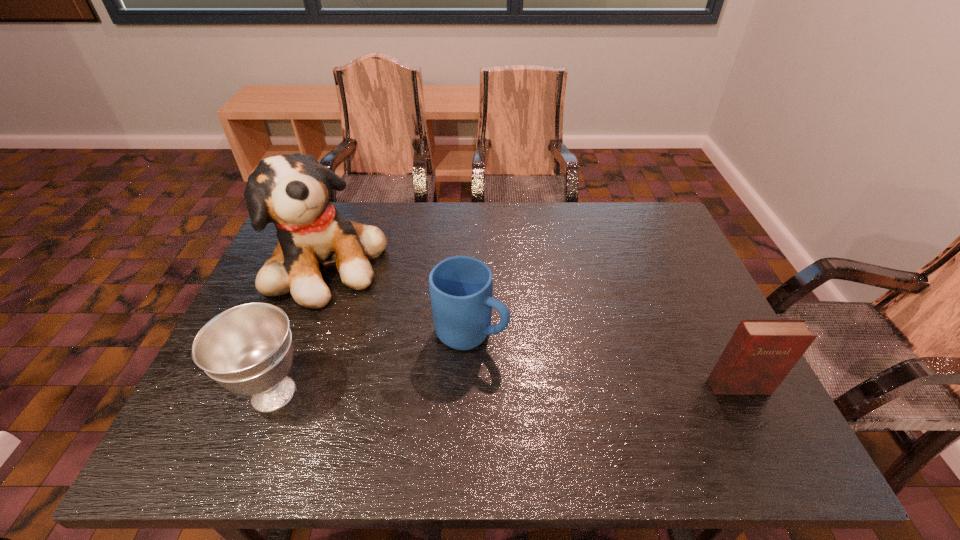
What are the coordinates of `object at the near right corner` in the screenshot? It's located at (761, 352).

This screenshot has width=960, height=540. In order to click on free point at the far edge in this screenshot , I will do `click(590, 246)`.

Find the location of a particular element. This screenshot has height=540, width=960. free space at the near edge of the desktop is located at coordinates (370, 384).

At what (x,y) coordinates should I click in order to perform the action: click on free space at the right edge of the desktop. Please return your answer as a coordinate pair (x, y). Image resolution: width=960 pixels, height=540 pixels. Looking at the image, I should click on (667, 320).

What are the coordinates of `vacant space at the near right corner` in the screenshot? It's located at tap(700, 404).

This screenshot has width=960, height=540. I want to click on free space between the mug and the rightmost object, so click(x=605, y=360).

Locate an element on the screen. This screenshot has width=960, height=540. vacant area between the mug and the chalice is located at coordinates (372, 363).

The width and height of the screenshot is (960, 540). What are the coordinates of `vacant area that lies between the rightmost object and the tallest object` in the screenshot? It's located at (534, 326).

Where is `free space between the puppy and the mug`? The image size is (960, 540). free space between the puppy and the mug is located at coordinates (400, 299).

This screenshot has width=960, height=540. Identify the location of unoccupied position between the rightmost object and the tallest object. (534, 326).